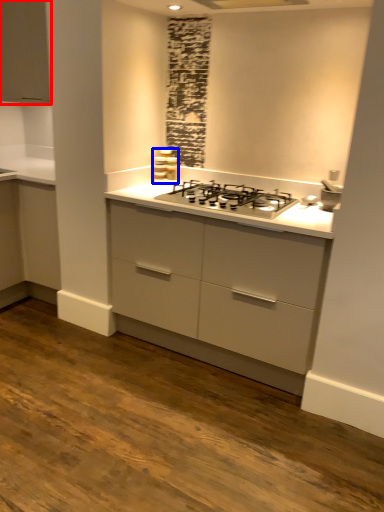
Question: Which object is further to the camera taking this photo, cabinetry (highlighted by a red box) or appliance (highlighted by a blue box)?

Choices:
 (A) cabinetry
 (B) appliance

Answer: (B)